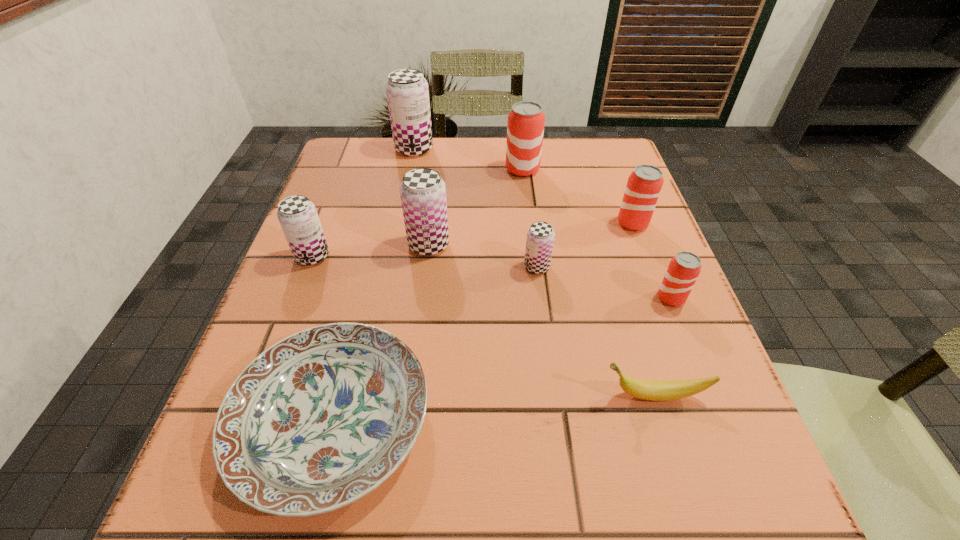
Identify the location of free area in between the leftmost orange beer can and the third smallest purple beer can. The image size is (960, 540). (475, 207).

Where is `vacant area that lies between the smallest purple beer can and the nearest beer can`? vacant area that lies between the smallest purple beer can and the nearest beer can is located at coordinates (604, 282).

Find the location of `vacant space that's between the second biggest orange beer can and the leftmost purple beer can`. vacant space that's between the second biggest orange beer can and the leftmost purple beer can is located at coordinates (472, 240).

What are the coordinates of `free point between the rightmost purple beer can and the yellow banana` in the screenshot? It's located at (595, 331).

Where is `free space between the smallest purple beer can and the shortest object`? This screenshot has height=540, width=960. free space between the smallest purple beer can and the shortest object is located at coordinates (435, 343).

Image resolution: width=960 pixels, height=540 pixels. Find the location of `vacant space that is in between the second farthest orange beer can and the eighth tallest object`. vacant space that is in between the second farthest orange beer can and the eighth tallest object is located at coordinates (643, 309).

Identify which object is located as the eighth nearest to the second biggest orange beer can. Please provide its 2D coordinates. Your answer should be formatted as a tuple, i.e. [(x, y)], where the tuple contains the x and y coordinates of a point satisfying the conditions above.

[(298, 217)]

Image resolution: width=960 pixels, height=540 pixels. I want to click on the seventh closest object to the tallest object, so click(x=684, y=268).

At what (x,y) coordinates should I click in order to perform the action: click on beer can that is the fifth nearest to the second biggest purple beer can. Please return your answer as a coordinate pair (x, y). Looking at the image, I should click on (644, 185).

Find the location of `the fourth closest beer can relative to the smallest orange beer can`. the fourth closest beer can relative to the smallest orange beer can is located at coordinates (525, 127).